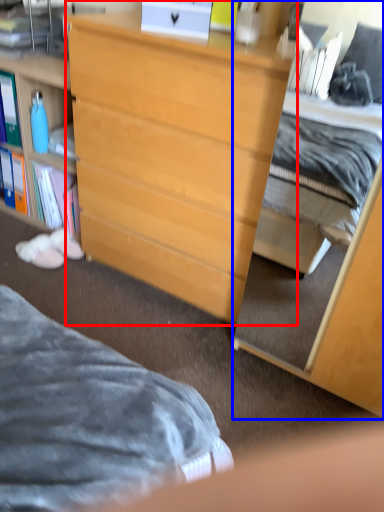
Question: Which point is closer to the camera, desk (highlighted by a red box) or cabinetry (highlighted by a blue box)?

Choices:
 (A) desk
 (B) cabinetry

Answer: (B)